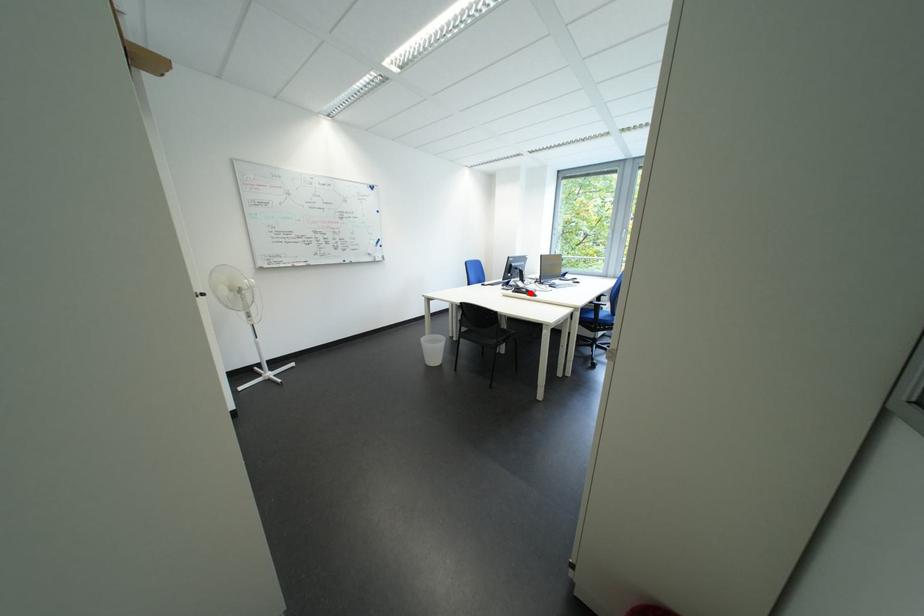
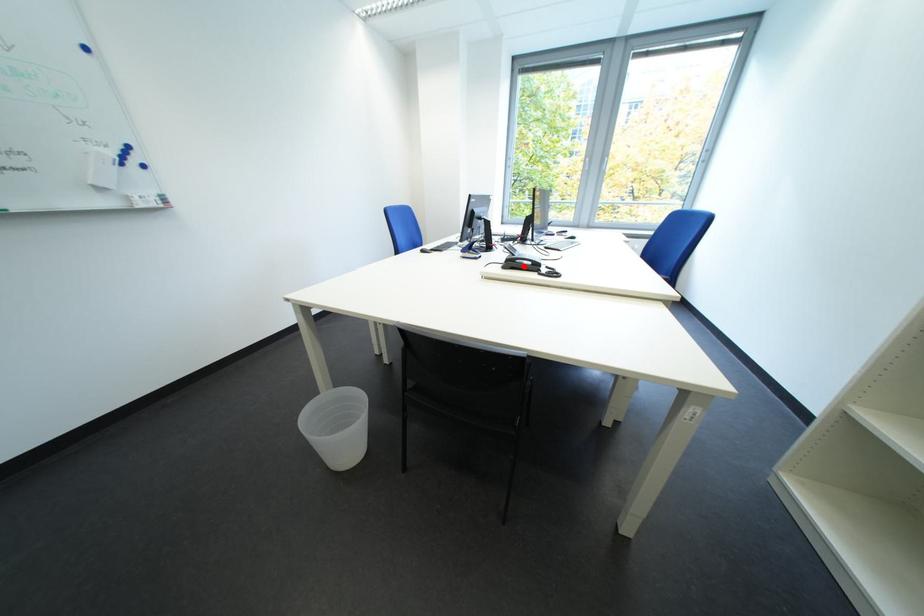
I am providing you with two images of the same scene from different viewpoints. A red point is marked on the first image and another point is marked on the second image. Does the point marked in image1 correspond to the same location as the one in image2?

Yes